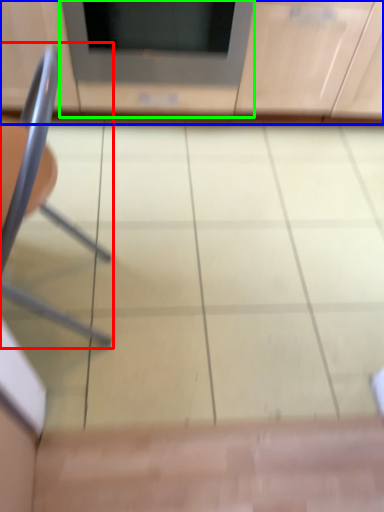
Question: Estimate the real-world distances between objects in this image. Which object is closer to chair (highlighted by a red box), cabinetry (highlighted by a blue box) or appliance (highlighted by a green box)?

Choices:
 (A) cabinetry
 (B) appliance

Answer: (B)